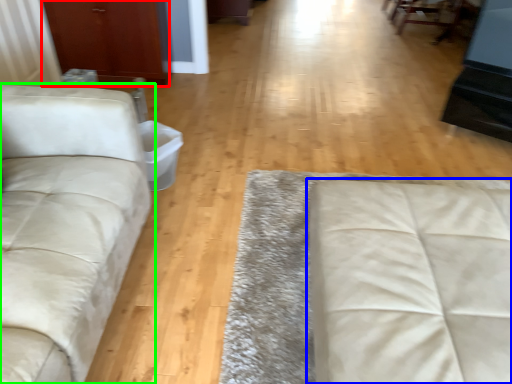
Question: Which object is the farthest from armoire (highlighted by a red box)? Choose among these: studio couch (highlighted by a blue box) or studio couch (highlighted by a green box).

Choices:
 (A) studio couch
 (B) studio couch

Answer: (A)